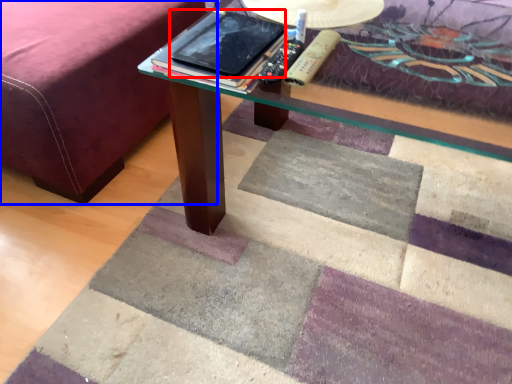
Question: Among these objects, which one is nearest to the camera, tablet computer (highlighted by a red box) or bed frame (highlighted by a blue box)?

Choices:
 (A) tablet computer
 (B) bed frame

Answer: (A)